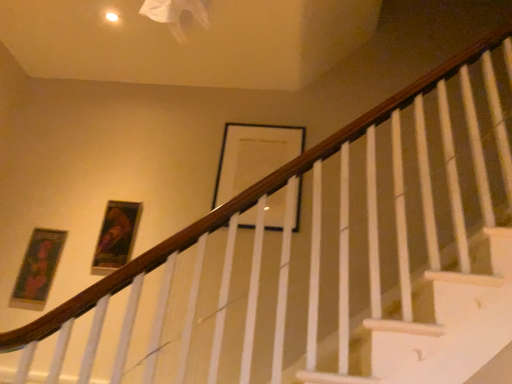
Question: In which direction should I rotate to look at black matte picture frame at upper center, which is counted as the third picture frame, starting from the left?

Choices:
 (A) left
 (B) right

Answer: (B)

Question: From the image's perspective, would you say black matte picture frame at upper center, which is counted as the third picture frame, starting from the left, is shown under wooden framed portrait at upper left, which appears as the 2th picture frame when viewed from the left?

Choices:
 (A) yes
 (B) no

Answer: (B)

Question: Is black matte picture frame at upper center, which is counted as the third picture frame, starting from the left, positioned before wooden framed portrait at upper left, which ranks as the 2th picture frame in right-to-left order?

Choices:
 (A) yes
 (B) no

Answer: (B)

Question: Does black matte picture frame at upper center, which is counted as the third picture frame, starting from the left, have a lesser height compared to wooden framed portrait at upper left, which ranks as the 2th picture frame in right-to-left order?

Choices:
 (A) yes
 (B) no

Answer: (B)

Question: From the image's perspective, is black matte picture frame at upper center, which appears as the 1th picture frame when viewed from the right, on wooden framed portrait at upper left, which ranks as the 2th picture frame in right-to-left order?

Choices:
 (A) yes
 (B) no

Answer: (A)

Question: From a real-world perspective, does black matte picture frame at upper center, which is counted as the third picture frame, starting from the left, sit lower than wooden framed portrait at upper left, which appears as the 2th picture frame when viewed from the left?

Choices:
 (A) no
 (B) yes

Answer: (A)

Question: Does black matte picture frame at upper center, which is counted as the third picture frame, starting from the left, touch wooden framed portrait at upper left, which ranks as the 2th picture frame in right-to-left order?

Choices:
 (A) no
 (B) yes

Answer: (A)

Question: Considering the relative positions of black matte picture frame at upper center, which is counted as the third picture frame, starting from the left, and matte gold picture frame at left, which is the third picture frame from right to left, in the image provided, is black matte picture frame at upper center, which is counted as the third picture frame, starting from the left, to the right of matte gold picture frame at left, which is the third picture frame from right to left, from the viewer's perspective?

Choices:
 (A) no
 (B) yes

Answer: (B)

Question: Could you tell me if black matte picture frame at upper center, which appears as the 1th picture frame when viewed from the right, is turned towards matte gold picture frame at left, the first picture frame in the left-to-right sequence?

Choices:
 (A) no
 (B) yes

Answer: (A)

Question: Would you say black matte picture frame at upper center, which appears as the 1th picture frame when viewed from the right, is outside matte gold picture frame at left, which is the third picture frame from right to left?

Choices:
 (A) no
 (B) yes

Answer: (B)

Question: From the image's perspective, is black matte picture frame at upper center, which appears as the 1th picture frame when viewed from the right, under matte gold picture frame at left, which is the third picture frame from right to left?

Choices:
 (A) yes
 (B) no

Answer: (B)

Question: Is black matte picture frame at upper center, which is counted as the third picture frame, starting from the left, bigger than matte gold picture frame at left, which is the third picture frame from right to left?

Choices:
 (A) no
 (B) yes

Answer: (B)

Question: Is black matte picture frame at upper center, which appears as the 1th picture frame when viewed from the right, positioned behind matte gold picture frame at left, which is the third picture frame from right to left?

Choices:
 (A) yes
 (B) no

Answer: (A)

Question: Is matte gold picture frame at left, which is the third picture frame from right to left, smaller than wooden framed portrait at upper left, which appears as the 2th picture frame when viewed from the left?

Choices:
 (A) yes
 (B) no

Answer: (A)